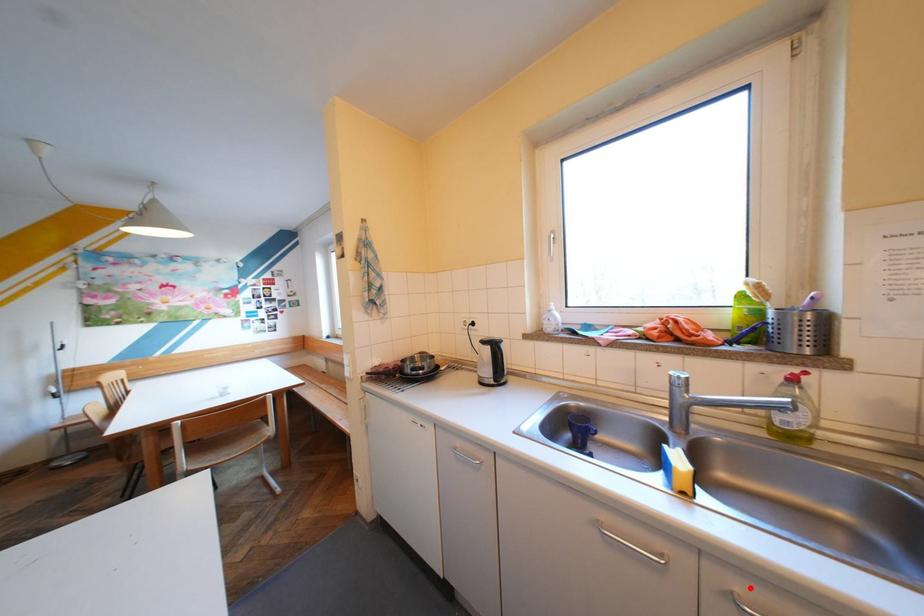
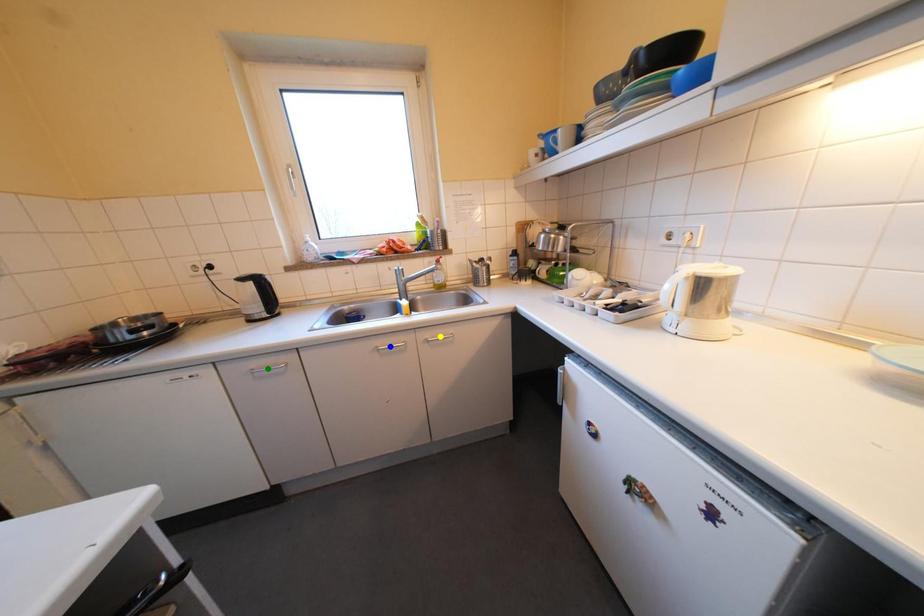
Question: I am providing you with two images of the same scene from different viewpoints. A red point is marked on the first image. You are given multiple points on the second image. Can you choose the point in image 2 that corresponds to the point in image 1?

Choices:
 (A) green point
 (B) blue point
 (C) yellow point

Answer: (C)